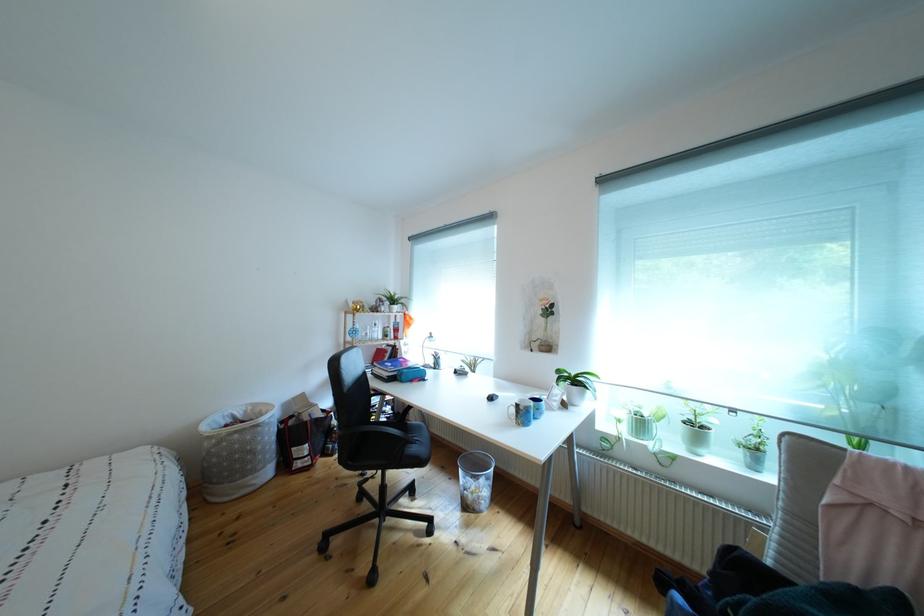
What are the coordinates of `chair sitting surface` in the screenshot? It's located at (408, 431).